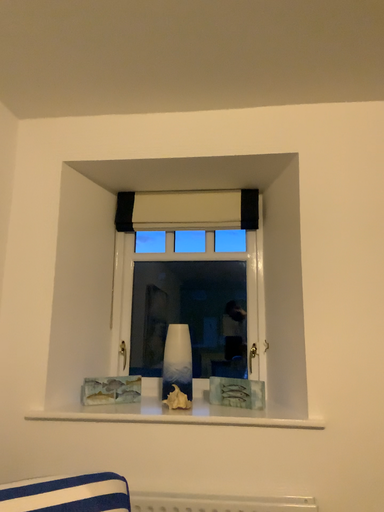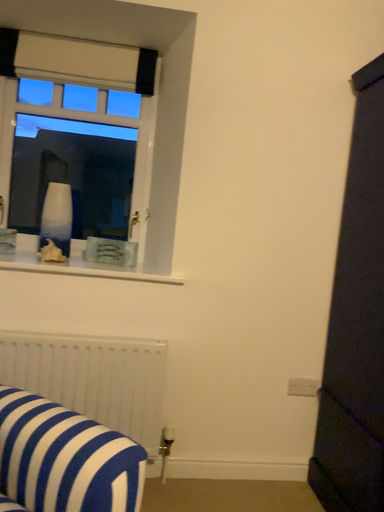
Question: Which way did the camera rotate in the video?

Choices:
 (A) rotated left
 (B) rotated right

Answer: (B)